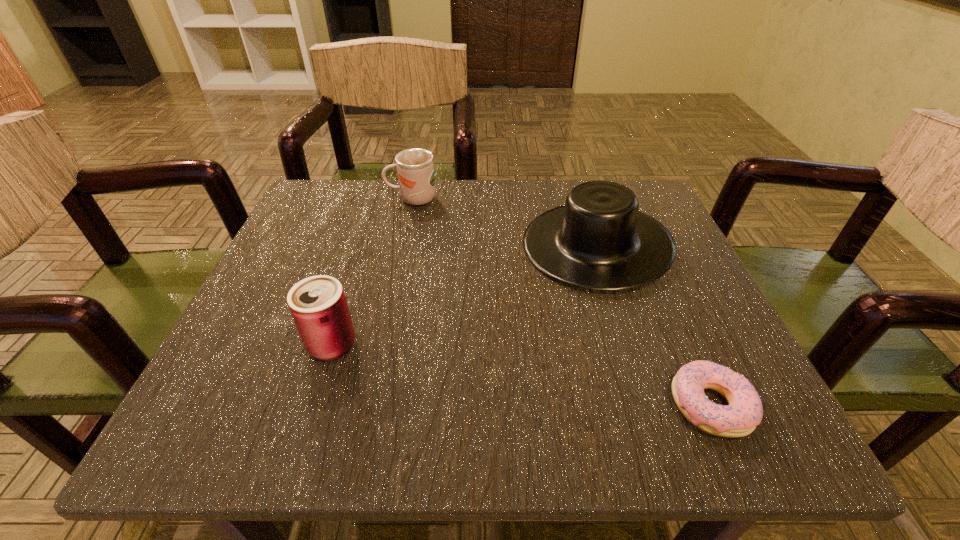
Locate an element on the screen. The width and height of the screenshot is (960, 540). cup is located at coordinates (415, 168).

Locate an element on the screen. dress hat is located at coordinates (599, 240).

You are a GUI agent. You are given a task and a screenshot of the screen. Output one action in this format:
    pyautogui.click(x=<x>, y=<y>)
    Task: Click on the second nearest object
    The image size is (960, 540).
    Given the screenshot: What is the action you would take?
    pyautogui.click(x=318, y=305)

The width and height of the screenshot is (960, 540). What are the coordinates of `doughnut` in the screenshot? It's located at (738, 419).

Find the location of a particular element. the shortest object is located at coordinates (738, 419).

The image size is (960, 540). Find the location of `free space located on the side with the handle of the cup`. free space located on the side with the handle of the cup is located at coordinates (363, 199).

At what (x,y) coordinates should I click in order to perform the action: click on free region located on the side with the handle of the cup. Please return your answer as a coordinate pair (x, y). The height and width of the screenshot is (540, 960). Looking at the image, I should click on (303, 199).

You are a GUI agent. You are given a task and a screenshot of the screen. Output one action in this format:
    pyautogui.click(x=<x>, y=<y>)
    Task: Click on the vacant area situated 0.130m on the side with the handle of the cup
    This screenshot has height=540, width=960.
    Given the screenshot: What is the action you would take?
    pyautogui.click(x=326, y=199)

Locate an element on the screen. This screenshot has height=540, width=960. free space located on the left of the dress hat is located at coordinates (403, 245).

I want to click on free space located on the right of the second nearest object, so click(436, 345).